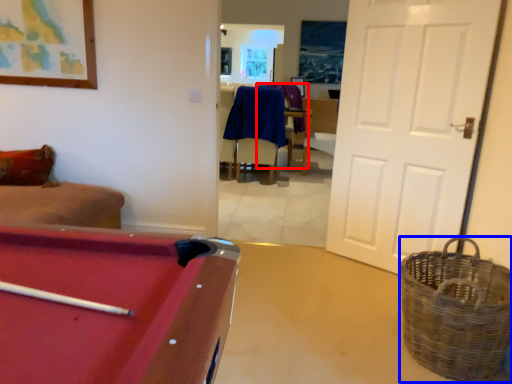
Question: Which of the following is the farthest to the observer, armchair (highlighted by a red box) or basket (highlighted by a blue box)?

Choices:
 (A) armchair
 (B) basket

Answer: (A)